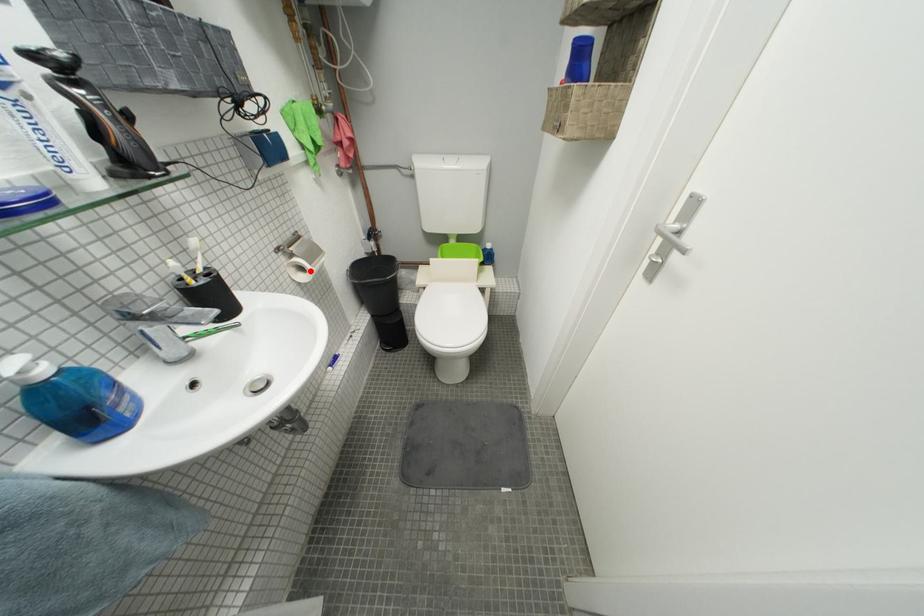
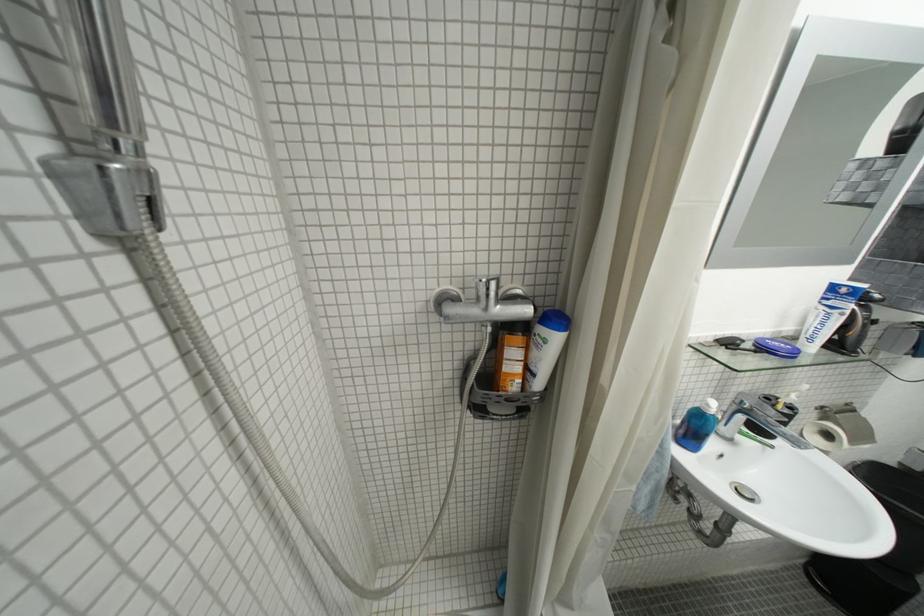
Question: A red point is marked in image1. In image2, is the corresponding 3D point closer to the camera or farther? Reply with the corresponding letter.

Choices:
 (A) The corresponding 3D point is closer.
 (B) The corresponding 3D point is farther.

Answer: (A)